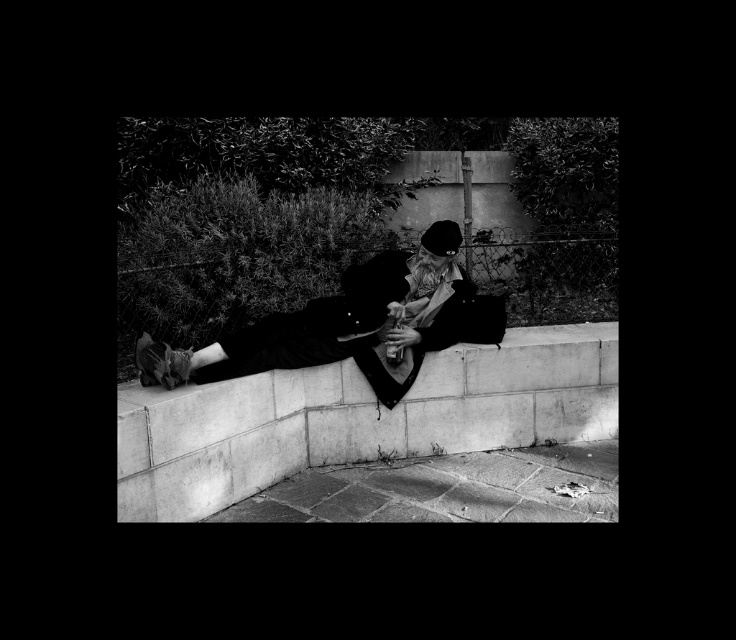
Question: Which point is closer to the camera?

Choices:
 (A) concrete at lower center
 (B) black leather jacket at center

Answer: (A)

Question: Is concrete at lower center positioned before black leather jacket at center?

Choices:
 (A) no
 (B) yes

Answer: (B)

Question: Is concrete at lower center bigger than black leather jacket at center?

Choices:
 (A) yes
 (B) no

Answer: (A)

Question: Is concrete at lower center positioned before black leather jacket at center?

Choices:
 (A) yes
 (B) no

Answer: (A)